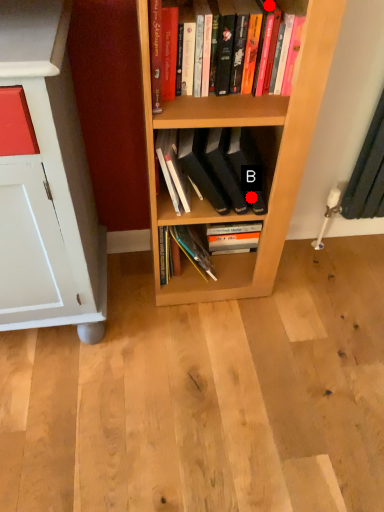
Question: Two points are circled on the image, labeled by A and B beside each circle. Among these points, which one is nearest to the camera?

Choices:
 (A) A is closer
 (B) B is closer

Answer: (A)